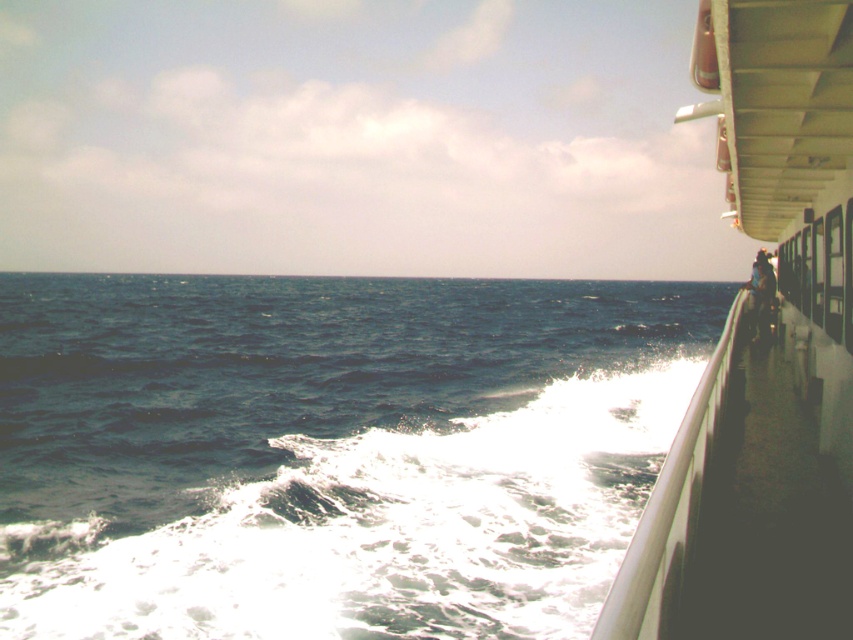
You are standing on the deck of the ship and want to place your brown leather jacket at right on the white glossy boat at right. Given the sizes of both objects, will the jacket fit entirely on the boat?

The white glossy boat at right is wider than the brown leather jacket at right, so the jacket will fit entirely on the boat.

You are standing on the ship deck and see the blue water at lower left and the brown leather jacket at right. Which object is closer to the left edge of the deck?

The blue water at lower left is closer to the left edge of the deck since it is positioned on the left side of the brown leather jacket at right.